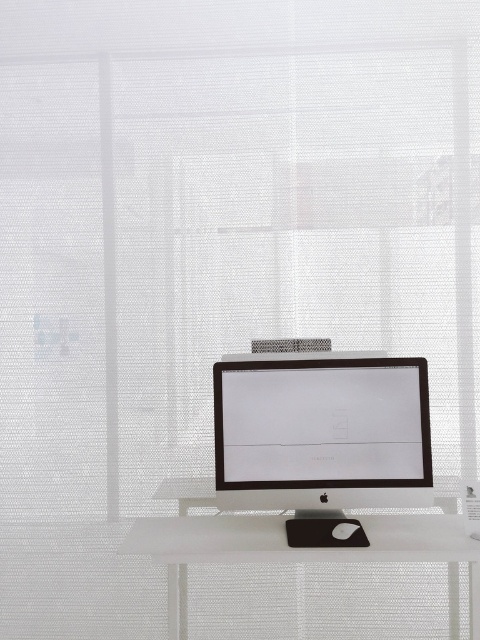
Can you confirm if satin black monitor at center is shorter than white matte computer desk at center?

No, satin black monitor at center is not shorter than white matte computer desk at center.

At what (x,y) coordinates should I click in order to perform the action: click on satin black monitor at center. Please return your answer as a coordinate pair (x, y). The height and width of the screenshot is (640, 480). Looking at the image, I should click on (322, 432).

Does white matte computer desk at center appear under black plastic mouse at center?

Correct, white matte computer desk at center is located below black plastic mouse at center.

Is point (244, 561) more distant than point (345, 525)?

No, (244, 561) is closer to viewer.

This screenshot has width=480, height=640. Identify the location of white matte computer desk at center. (297, 548).

Does satin black monitor at center appear on the left side of black plastic mouse at center?

Indeed, satin black monitor at center is positioned on the left side of black plastic mouse at center.

Which is more to the left, satin black monitor at center or black plastic mouse at center?

From the viewer's perspective, satin black monitor at center appears more on the left side.

Which is behind, point (317, 499) or point (346, 525)?

The point (317, 499) is more distant.

Locate an element on the screen. The image size is (480, 640). satin black monitor at center is located at coordinates (322, 432).